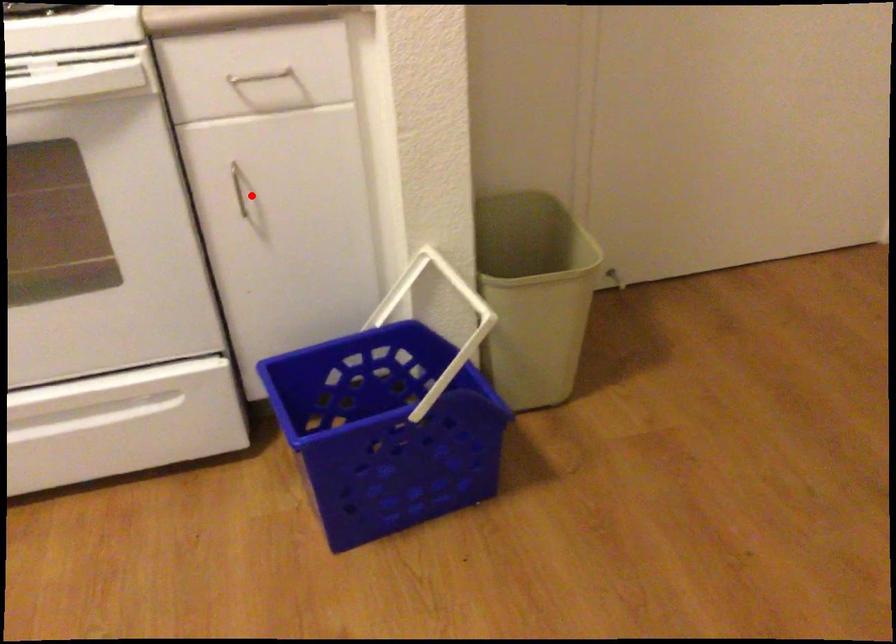
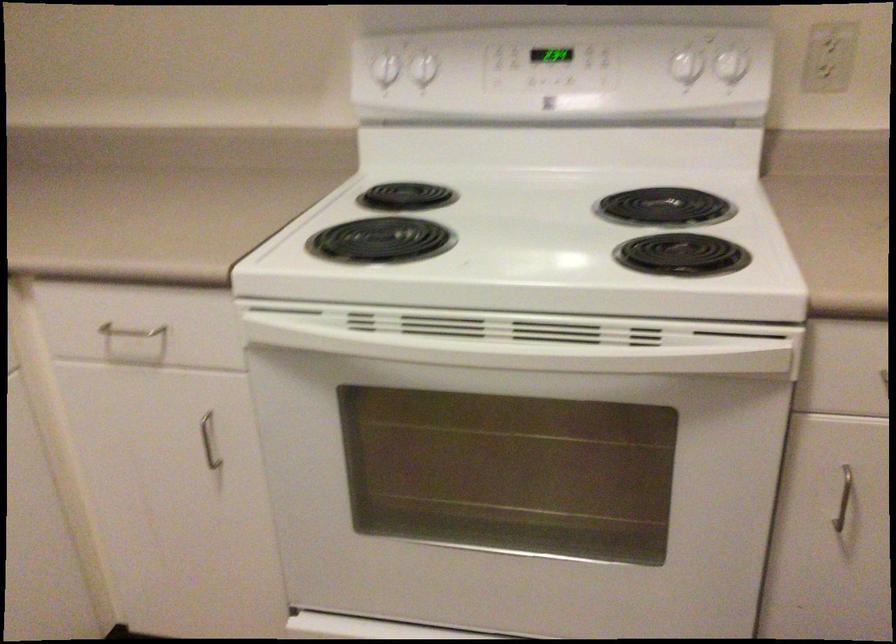
Question: I am providing you with two images of the same scene from different viewpoints. Image1 has a red point marked. In image2, the corresponding 3D location appears at what relative position? Reply with the corresponding letter.

Choices:
 (A) Closer
 (B) Farther

Answer: (A)